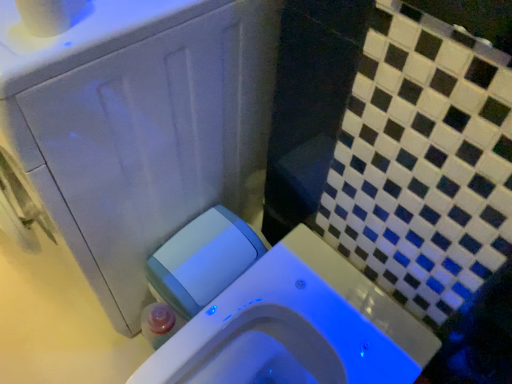
The image size is (512, 384). Describe the element at coordinates (294, 325) in the screenshot. I see `white glossy toilet at center` at that location.

What do you see at coordinates (203, 260) in the screenshot? Image resolution: width=512 pixels, height=384 pixels. I see `white plastic water tank at lower left` at bounding box center [203, 260].

You are a GUI agent. You are given a task and a screenshot of the screen. Output one action in this format:
    pyautogui.click(x=<x>, y=<y>)
    Task: Click on the white matte toilet paper at upper left
    The width and height of the screenshot is (512, 384).
    Given the screenshot: What is the action you would take?
    pyautogui.click(x=49, y=15)

Is white glossy toilet at center turned away from white matte toilet paper at upper left?

No, white glossy toilet at center is not facing the opposite direction of white matte toilet paper at upper left.

How distant is white glossy toilet at center from white matte toilet paper at upper left?

They are 24.62 inches apart.

Is white glossy toilet at center bigger than white matte toilet paper at upper left?

Yes.

Measure the distance from white plastic water tank at lower left to white matte toilet paper at upper left.

They are 20.87 inches apart.

Can you confirm if white plastic water tank at lower left is bigger than white matte toilet paper at upper left?

Yes, white plastic water tank at lower left is bigger than white matte toilet paper at upper left.

Considering the relative sizes of white plastic water tank at lower left and white matte toilet paper at upper left in the image provided, is white plastic water tank at lower left wider than white matte toilet paper at upper left?

Yes, white plastic water tank at lower left is wider than white matte toilet paper at upper left.

From their relative heights in the image, would you say white plastic water tank at lower left is taller or shorter than white matte toilet paper at upper left?

In the image, white plastic water tank at lower left appears to be taller than white matte toilet paper at upper left.

Considering the positions of objects white matte toilet paper at upper left and white glossy toilet at center in the image provided, who is in front, white matte toilet paper at upper left or white glossy toilet at center?

Positioned in front is white matte toilet paper at upper left.

Which of these two, white matte toilet paper at upper left or white glossy toilet at center, is wider?

Wider between the two is white glossy toilet at center.

From a real-world perspective, which is physically above, white matte toilet paper at upper left or white glossy toilet at center?

white matte toilet paper at upper left is physically above.

In the image, is white matte toilet paper at upper left on the left side or the right side of white glossy toilet at center?

Based on their positions, white matte toilet paper at upper left is located to the left of white glossy toilet at center.

Locate an element on the screen. water tank located on the left of white glossy toilet at center is located at coordinates (203, 260).

From the image's perspective, is white plastic water tank at lower left located beneath white glossy toilet at center?

No.

Visually, is white plastic water tank at lower left positioned to the left or to the right of white glossy toilet at center?

In the image, white plastic water tank at lower left appears on the left side of white glossy toilet at center.

Is white glossy toilet at center far from white plastic water tank at lower left?

They are positioned close to each other.

From the image's perspective, which one is positioned higher, white glossy toilet at center or white plastic water tank at lower left?

white plastic water tank at lower left appears higher in the image.

Can white plastic water tank at lower left be found inside white glossy toilet at center?

No, white plastic water tank at lower left is not a part of white glossy toilet at center.

How many degrees apart are the facing directions of white matte toilet paper at upper left and white plastic water tank at lower left?

The facing directions of white matte toilet paper at upper left and white plastic water tank at lower left are 0.0584 degrees apart.

Measure the distance from white matte toilet paper at upper left to white plastic water tank at lower left.

white matte toilet paper at upper left is 20.87 inches away from white plastic water tank at lower left.

Is white matte toilet paper at upper left at the right side of white plastic water tank at lower left?

No, white matte toilet paper at upper left is not to the right of white plastic water tank at lower left.

Considering the sizes of objects white matte toilet paper at upper left and white plastic water tank at lower left in the image provided, who is shorter, white matte toilet paper at upper left or white plastic water tank at lower left?

white matte toilet paper at upper left.

Where is `toilet behind the white matte toilet paper at upper left`? The height and width of the screenshot is (384, 512). toilet behind the white matte toilet paper at upper left is located at coordinates (294, 325).

In order to click on toilet paper in front of the white plastic water tank at lower left in this screenshot , I will do `click(49, 15)`.

Considering their positions, is white plastic water tank at lower left positioned closer to white glossy toilet at center than white matte toilet paper at upper left?

white plastic water tank at lower left.

Looking at the image, which one is located further to white glossy toilet at center, white matte toilet paper at upper left or white plastic water tank at lower left?

white matte toilet paper at upper left is positioned further to the anchor white glossy toilet at center.

Based on their spatial positions, is white matte toilet paper at upper left or white glossy toilet at center closer to white plastic water tank at lower left?

white glossy toilet at center is positioned closer to the anchor white plastic water tank at lower left.

Looking at the image, which one is located further to white plastic water tank at lower left, white glossy toilet at center or white matte toilet paper at upper left?

white matte toilet paper at upper left.

When comparing their distances from white matte toilet paper at upper left, does white glossy toilet at center or white plastic water tank at lower left seem further?

Among the two, white glossy toilet at center is located further to white matte toilet paper at upper left.

Which object lies nearer to the anchor point white matte toilet paper at upper left, white plastic water tank at lower left or white glossy toilet at center?

white plastic water tank at lower left lies closer to white matte toilet paper at upper left than the other object.

You are a GUI agent. You are given a task and a screenshot of the screen. Output one action in this format:
    pyautogui.click(x=<x>, y=<y>)
    Task: Click on the water tank between white matte toilet paper at upper left and white glossy toilet at center in the up-down direction
    
    Given the screenshot: What is the action you would take?
    pyautogui.click(x=203, y=260)